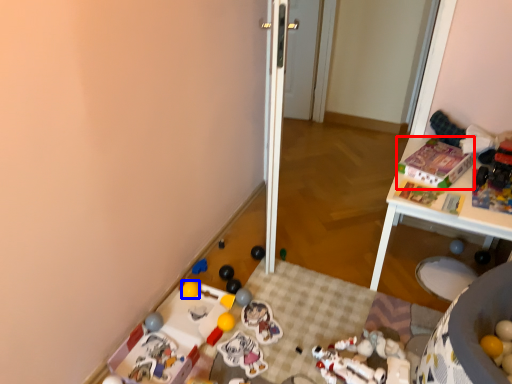
Question: Among these objects, which one is nearest to the camera, toy (highlighted by a red box) or toy (highlighted by a blue box)?

Choices:
 (A) toy
 (B) toy

Answer: (A)